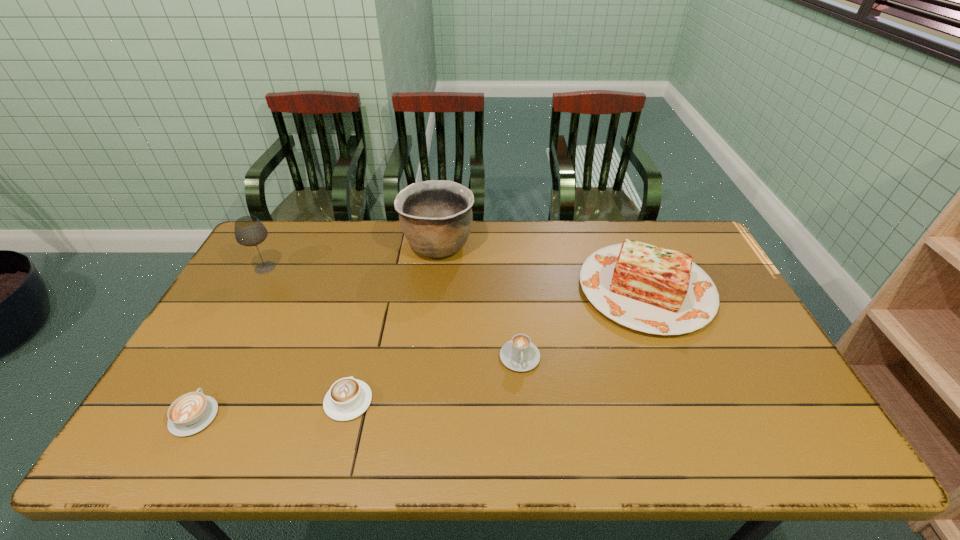
What are the coordinates of `empty space that is in between the leftmost cappuccino and the wineglass` in the screenshot? It's located at (229, 342).

At what (x,y) coordinates should I click in order to perform the action: click on empty location between the second cappuccino from right to left and the shortest cappuccino. Please return your answer as a coordinate pair (x, y). The width and height of the screenshot is (960, 540). Looking at the image, I should click on (272, 408).

I want to click on free space between the wineglass and the pottery, so click(351, 256).

Locate an element on the screen. The height and width of the screenshot is (540, 960). empty space that is in between the second tallest cappuccino and the pottery is located at coordinates coord(394,323).

Where is `vacant space in between the wineglass and the farthest cappuccino`? This screenshot has height=540, width=960. vacant space in between the wineglass and the farthest cappuccino is located at coordinates (393, 312).

Identify the location of the closest object to the wineglass. (436, 217).

Select which object is the third closest to the wineglass. Please provide its 2D coordinates. Your answer should be formatted as a tuple, i.e. [(x, y)], where the tuple contains the x and y coordinates of a point satisfying the conditions above.

[(348, 398)]

Where is `cappuccino that stands as the second closest to the pottery`? The image size is (960, 540). cappuccino that stands as the second closest to the pottery is located at coordinates (348, 398).

Identify the location of cappuccino that is the closest to the second tallest cappuccino. This screenshot has width=960, height=540. (190, 413).

In order to click on free spot that satisfies the following two spatial constraints: 1. on the side of the shortest cappuccino with the handle; 2. on the left side of the fourth shortest object in this screenshot , I will do `click(262, 289)`.